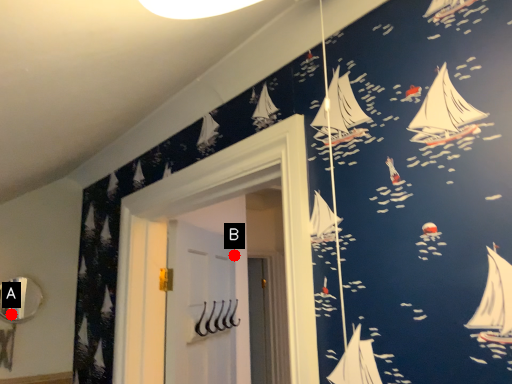
Question: Two points are circled on the image, labeled by A and B beside each circle. Among these points, which one is nearest to the camera?

Choices:
 (A) A is closer
 (B) B is closer

Answer: (A)